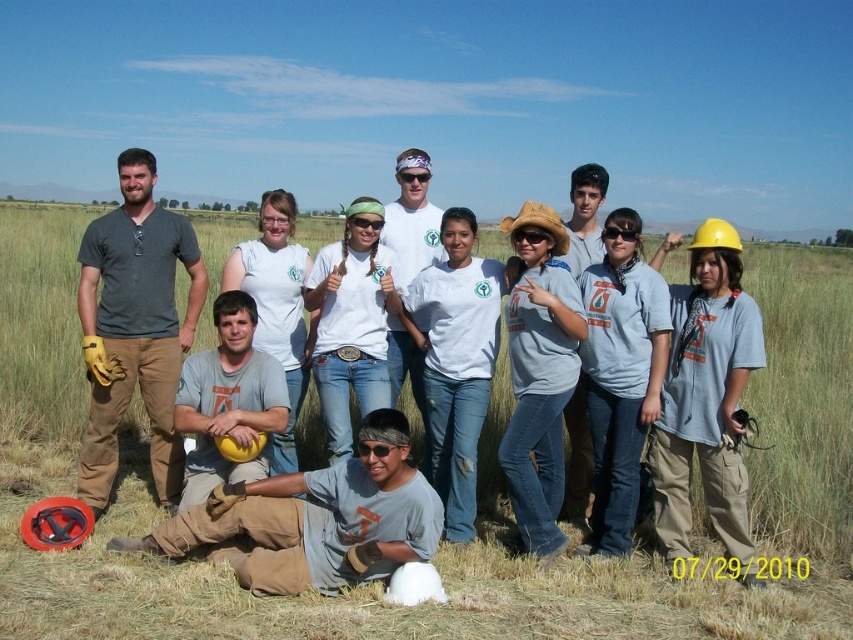
Which is below, gray cotton shirt at lower center or white cotton shirt at center?

Positioned lower is gray cotton shirt at lower center.

Does gray cotton shirt at lower center appear under white cotton shirt at center?

Indeed, gray cotton shirt at lower center is positioned under white cotton shirt at center.

Measure the distance between point (279, 497) and camera.

A distance of 15.58 feet exists between point (279, 497) and camera.

At what (x,y) coordinates should I click in order to perform the action: click on gray cotton shirt at lower center. Please return your answer as a coordinate pair (x, y). The height and width of the screenshot is (640, 853). Looking at the image, I should click on (315, 518).

Between gray cotton shirt at lower center and gray cotton shirt at center, which one has more height?

gray cotton shirt at center

Does gray cotton shirt at lower center have a larger size compared to gray cotton shirt at center?

Indeed, gray cotton shirt at lower center has a larger size compared to gray cotton shirt at center.

Find the location of a particular element. gray cotton shirt at lower center is located at coordinates (315, 518).

You are a GUI agent. You are given a task and a screenshot of the screen. Output one action in this format:
    pyautogui.click(x=<x>, y=<y>)
    Task: Click on the gray cotton shirt at lower center
    This screenshot has height=640, width=853.
    Given the screenshot: What is the action you would take?
    pyautogui.click(x=315, y=518)

Based on the photo, is gray cotton shirt at lower center closer to the viewer compared to gray cotton t-shirt at center?

That is True.

Between point (286, 515) and point (213, 412), which one is positioned in front?

Point (286, 515)

This screenshot has width=853, height=640. Identify the location of gray cotton shirt at lower center. (315, 518).